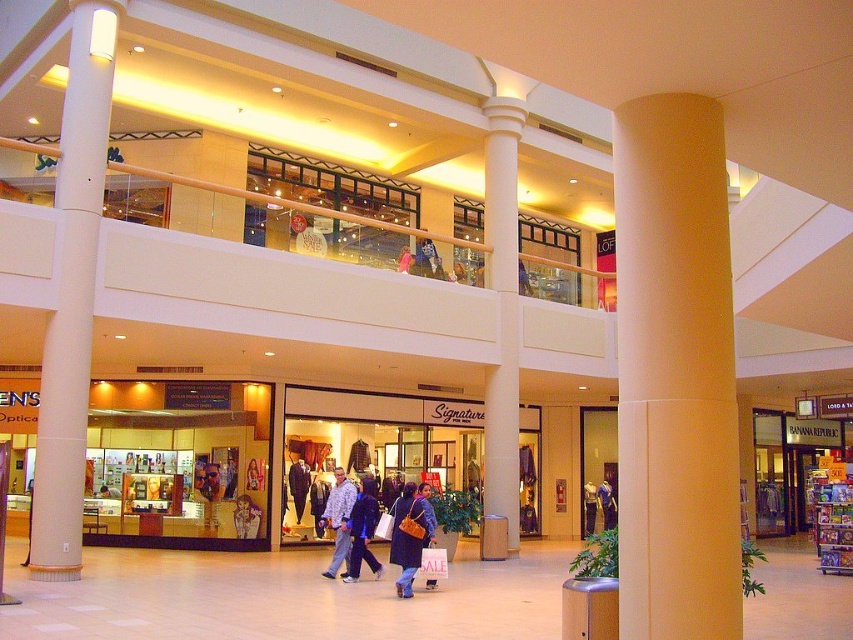
Who is shorter, dark blue suit at center or denim jacket at center?

denim jacket at center

Can you confirm if dark blue suit at center is wider than denim jacket at center?

No, dark blue suit at center is not wider than denim jacket at center.

Locate an element on the screen. The width and height of the screenshot is (853, 640). dark blue suit at center is located at coordinates click(x=299, y=484).

This screenshot has width=853, height=640. I want to click on dark blue suit at center, so click(299, 484).

Does dark blue suit at center have a lesser height compared to matte pink shirt at center?

No.

Who is more forward, (305,499) or (401,266)?

Point (401,266) is in front.

Identify the location of dark blue suit at center. (299, 484).

Which is behind, point (370, 561) or point (294, 490)?

The point (294, 490) is behind.

Does blue denim jeans at center appear over dark blue suit at center?

Correct, blue denim jeans at center is located above dark blue suit at center.

Does point (346, 579) come farther from viewer compared to point (291, 476)?

No, it is not.

Identify the location of blue denim jeans at center. (363, 531).